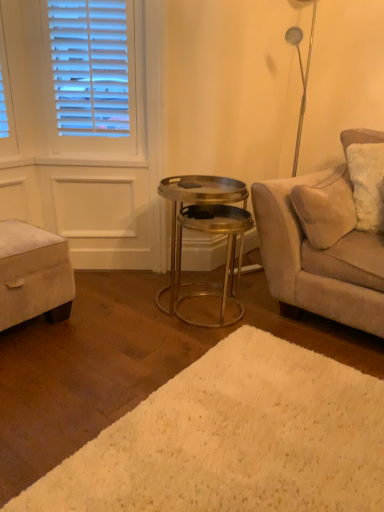
Identify the location of empty space that is ontop of white shag rug at lower center (from a real-world perspective). The image size is (384, 512). (259, 426).